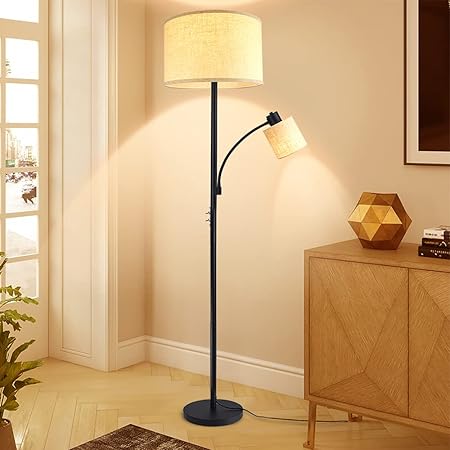
Where is `painting`? The width and height of the screenshot is (450, 450). painting is located at coordinates (426, 130).